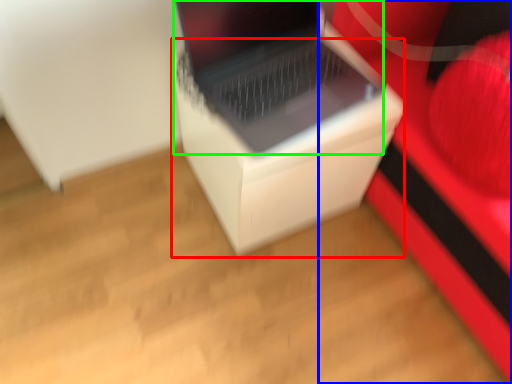
Question: Estimate the real-world distances between objects in this image. Which object is farther from cardboard box (highlighted by a red box), furniture (highlighted by a blue box) or laptop (highlighted by a green box)?

Choices:
 (A) furniture
 (B) laptop

Answer: (A)